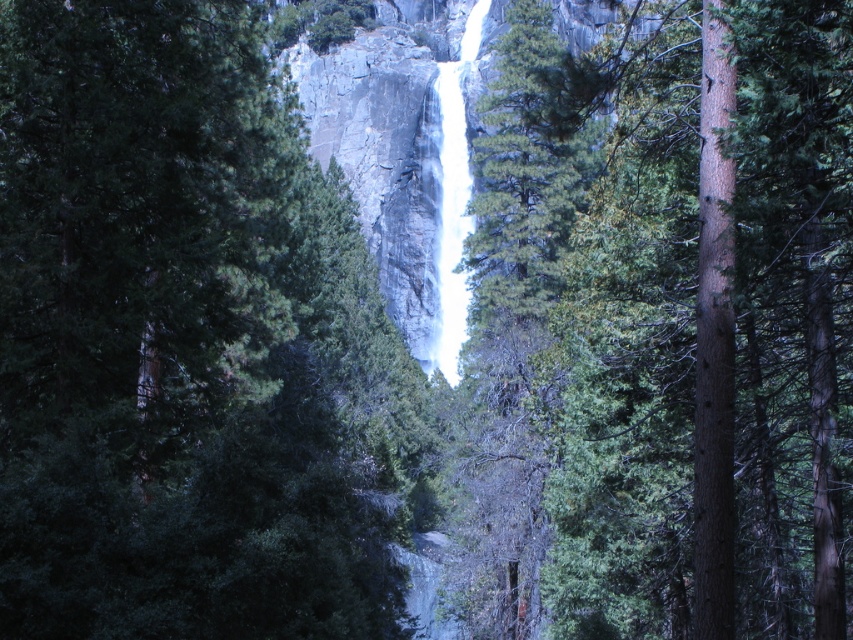
You are standing at the center of the image and want to reach the green matte tree at center. Which direction should you move to get closer to it?

The green matte tree at center is already at the center of the image, so you are already positioned directly in front of it. No movement is required to reach it.

You are standing at the base of the waterfall and want to take a photo. There are two points of interest marked as point (427, 428) and point (579, 164). Which point is closer to you?

Point (579, 164) is closer to you because it is less further to the camera than point (427, 428).